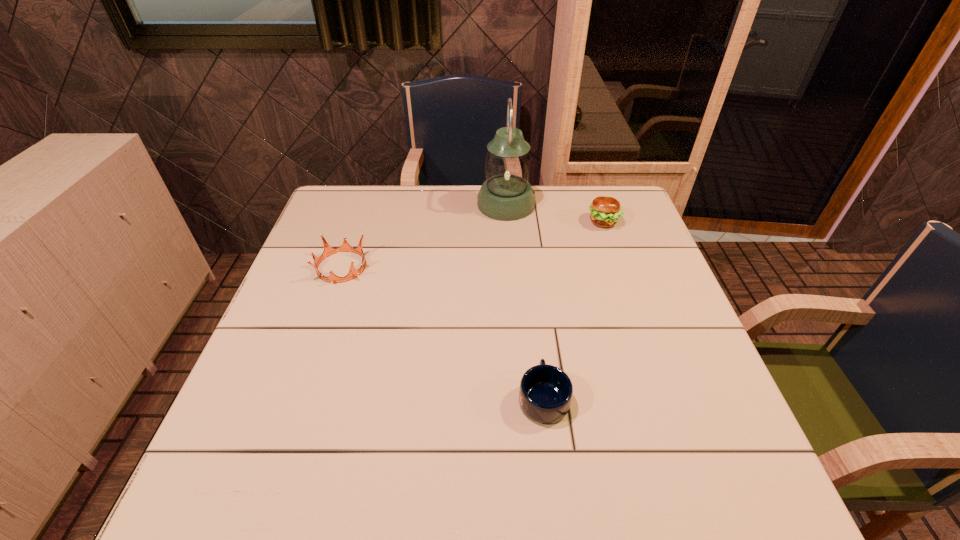
The width and height of the screenshot is (960, 540). In the image, there is a desktop. Find the location of `free space at the right edge`. free space at the right edge is located at coordinates coord(678,441).

Where is `vacant space at the far left corner of the desktop`? Image resolution: width=960 pixels, height=540 pixels. vacant space at the far left corner of the desktop is located at coordinates (354, 220).

This screenshot has width=960, height=540. In the image, there is a desktop. Identify the location of vacant space at the near right corner. (672, 475).

Where is `vacant area that lies between the rightmost object and the mug`? vacant area that lies between the rightmost object and the mug is located at coordinates (573, 309).

Locate an element on the screen. This screenshot has width=960, height=540. free space between the crown and the tallest object is located at coordinates (423, 235).

Identify the location of vacant space in between the nearest object and the third farthest object. (443, 332).

Identify the location of unoccupied position between the leftmost object and the hamburger. This screenshot has height=540, width=960. (472, 244).

This screenshot has width=960, height=540. In order to click on vacant point located between the second tallest object and the second nearest object in this screenshot , I will do `click(472, 244)`.

Where is `vacant point located between the nearest object and the tallest object`? vacant point located between the nearest object and the tallest object is located at coordinates (524, 301).

Find the location of a particular element. The image size is (960, 540). free spot between the third shortest object and the leftmost object is located at coordinates (472, 244).